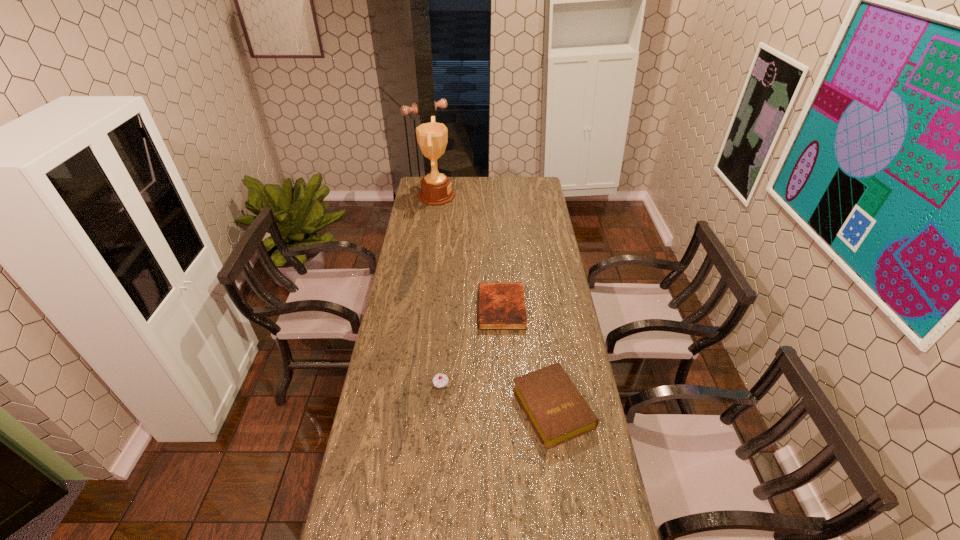
Image resolution: width=960 pixels, height=540 pixels. What are the coordinates of `free spot that satisfies the following two spatial constraints: 1. on the front-facing side of the cupcake; 2. on the left side of the tallest object` in the screenshot? It's located at (409, 386).

Identify the location of free space that satisfies the following two spatial constraints: 1. on the front-facing side of the award; 2. on the right side of the third tallest object. The width and height of the screenshot is (960, 540). (406, 408).

Locate an element on the screen. The image size is (960, 540). free space that satisfies the following two spatial constraints: 1. on the spine side of the shorter Bible; 2. on the left side of the second shortest object is located at coordinates (507, 408).